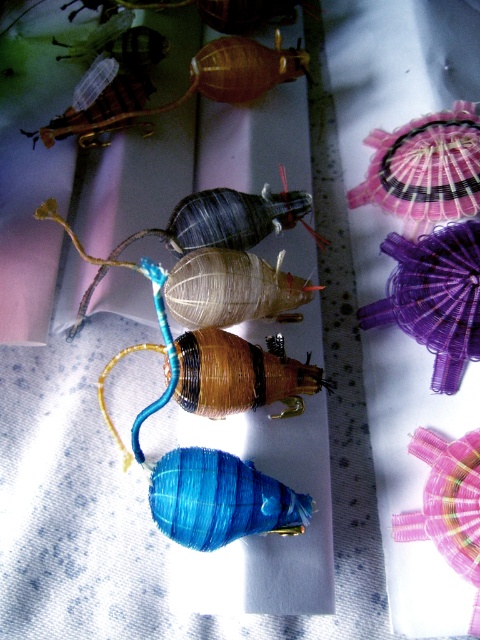
Question: In this image, where is matte blue spool at center located relative to translucent amber shell at upper center?

Choices:
 (A) above
 (B) below

Answer: (B)

Question: Is matte blue spool at center below translucent amber shell at upper center?

Choices:
 (A) yes
 (B) no

Answer: (A)

Question: Observing the image, what is the correct spatial positioning of matte blue spool at center in reference to translucent amber shell at upper center?

Choices:
 (A) left
 (B) right

Answer: (B)

Question: Which point is farther to the camera?

Choices:
 (A) (267, 81)
 (B) (243, 211)

Answer: (A)

Question: Which point is farther from the camera taking this photo?

Choices:
 (A) (249, 228)
 (B) (305, 60)

Answer: (B)